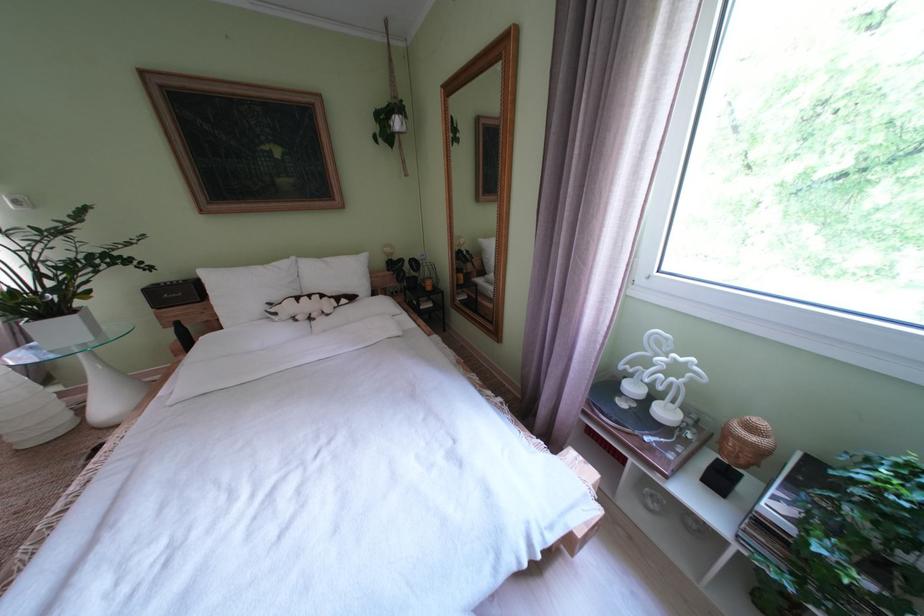
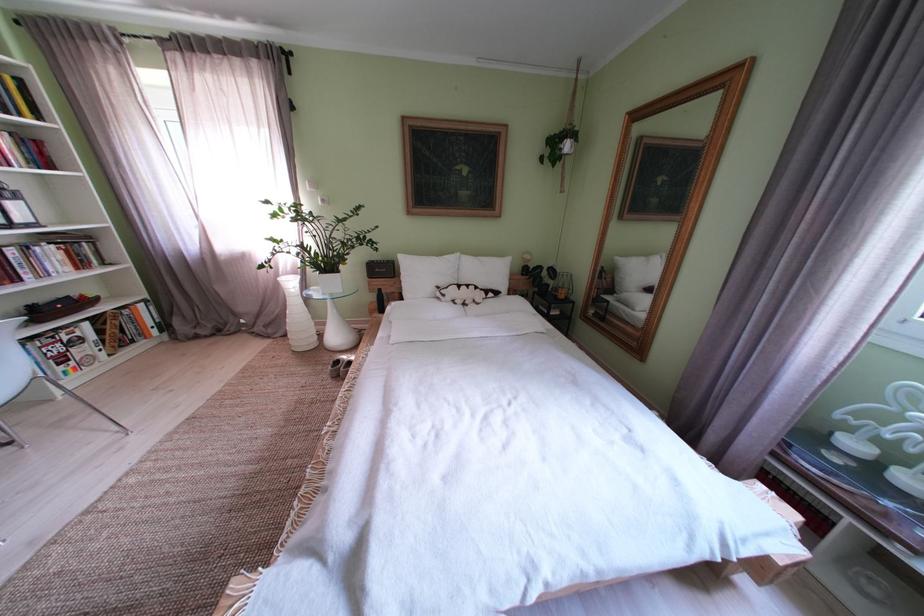
In the second image, find the point that corresponds to the point at 339,264 in the first image.

(492, 264)